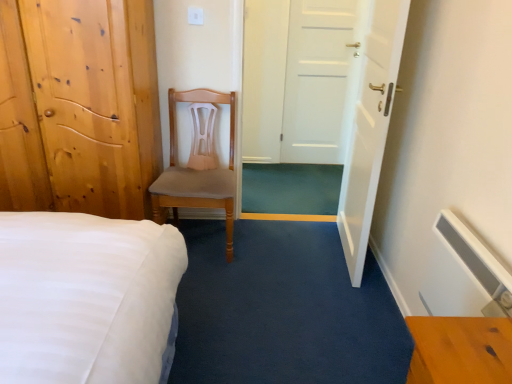
Describe the element at coordinates (316, 80) in the screenshot. The image size is (512, 384). I see `white matte door at center, which appears as the 2th door when viewed from the right` at that location.

The width and height of the screenshot is (512, 384). In order to click on white matte door at center, arranged as the 2th door when viewed from the left in this screenshot , I will do `click(316, 80)`.

The width and height of the screenshot is (512, 384). Describe the element at coordinates (198, 171) in the screenshot. I see `light brown wood chair at center` at that location.

The width and height of the screenshot is (512, 384). I want to click on white matte door at center, arranged as the 2th door when viewed from the left, so point(316,80).

Measure the distance from light brown wood chair at center to white matte door at center, arranged as the 2th door when viewed from the left.

light brown wood chair at center is 1.45 meters from white matte door at center, arranged as the 2th door when viewed from the left.

From a real-world perspective, which object stands above the other?

white matte door at center, arranged as the 2th door when viewed from the left, from a real-world perspective.

Image resolution: width=512 pixels, height=384 pixels. What are the coordinates of `door that is the 1st one when counting rightward from the light brown wood chair at center` in the screenshot? It's located at (316, 80).

Which of these two, light brown wooden door at left, which is the first door from left to right, or light brown wood chair at center, stands taller?

light brown wooden door at left, which is the first door from left to right, is taller.

Is the depth of light brown wooden door at left, which is the first door from left to right, less than that of light brown wood chair at center?

Yes, it is.

You are a GUI agent. You are given a task and a screenshot of the screen. Output one action in this format:
    pyautogui.click(x=<x>, y=<y>)
    Task: Click on the door that is the 2nd object located in front of the light brown wood chair at center
    The height and width of the screenshot is (384, 512).
    Given the screenshot: What is the action you would take?
    pyautogui.click(x=96, y=101)

Is light brown wooden door at left, the third door positioned from the right, positioned beyond the bounds of light brown wood chair at center?

Yes, light brown wooden door at left, the third door positioned from the right, is located beyond the bounds of light brown wood chair at center.

Consider the image. Considering the relative sizes of light brown wood chair at center and white glossy door at center, placed as the first door when sorted from right to left, in the image provided, is light brown wood chair at center smaller than white glossy door at center, placed as the first door when sorted from right to left,?

Incorrect, light brown wood chair at center is not smaller in size than white glossy door at center, placed as the first door when sorted from right to left.

Is light brown wood chair at center positioned with its back to white glossy door at center, placed as the first door when sorted from right to left?

No.

From the image's perspective, between light brown wood chair at center and white glossy door at center, placed as the first door when sorted from right to left, which one is located above?

white glossy door at center, placed as the first door when sorted from right to left, appears higher in the image.

Considering the positions of objects light brown wood chair at center and white glossy door at center, placed as the first door when sorted from right to left, in the image provided, who is more to the left, light brown wood chair at center or white glossy door at center, placed as the first door when sorted from right to left,?

light brown wood chair at center is more to the left.

Which door is the 2nd one when counting from the back of the light brown wooden door at left, the third door positioned from the right? Please provide its 2D coordinates.

[(316, 80)]

Is point (119, 186) less distant than point (303, 11)?

That is True.

Is light brown wooden door at left, which is the first door from left to right, at the left side of white matte door at center, arranged as the 2th door when viewed from the left?

Correct, you'll find light brown wooden door at left, which is the first door from left to right, to the left of white matte door at center, arranged as the 2th door when viewed from the left.

From a real-world perspective, relative to white matte door at center, which appears as the 2th door when viewed from the right, is white glossy door at center, placed as the first door when sorted from right to left, vertically above or below?

In terms of real-world spatial position, white glossy door at center, placed as the first door when sorted from right to left, is above white matte door at center, which appears as the 2th door when viewed from the right.

The height and width of the screenshot is (384, 512). Identify the location of door behind the white glossy door at center, placed as the first door when sorted from right to left. (316, 80).

Can you confirm if white glossy door at center, the 3th door viewed from the left, is thinner than white matte door at center, arranged as the 2th door when viewed from the left?

In fact, white glossy door at center, the 3th door viewed from the left, might be wider than white matte door at center, arranged as the 2th door when viewed from the left.

Is point (360, 39) positioned behind point (303, 21)?

No, (360, 39) is closer to viewer.

Are white glossy door at center, the 3th door viewed from the left, and light brown wood chair at center located far from each other?

No, white glossy door at center, the 3th door viewed from the left, is not far from light brown wood chair at center.

Could you measure the distance between white glossy door at center, placed as the first door when sorted from right to left, and light brown wood chair at center?

They are 33.72 inches apart.

Does point (404, 27) appear closer or farther from the camera than point (230, 129)?

Point (404, 27) appears to be closer to the viewer than point (230, 129).

From a real-world perspective, who is located higher, white glossy door at center, placed as the first door when sorted from right to left, or light brown wood chair at center?

white glossy door at center, placed as the first door when sorted from right to left, is physically above.

Is the depth of white matte door at center, arranged as the 2th door when viewed from the left, greater than that of light brown wood chair at center?

Yes, it is.

From the image's perspective, is white matte door at center, which appears as the 2th door when viewed from the right, above or below light brown wood chair at center?

white matte door at center, which appears as the 2th door when viewed from the right, is situated higher than light brown wood chair at center in the image.

Is white matte door at center, arranged as the 2th door when viewed from the left, facing away from light brown wood chair at center?

No, light brown wood chair at center is not at the back of white matte door at center, arranged as the 2th door when viewed from the left.

Does white matte door at center, which appears as the 2th door when viewed from the right, have a lesser width compared to light brown wood chair at center?

Yes, white matte door at center, which appears as the 2th door when viewed from the right, is thinner than light brown wood chair at center.

The height and width of the screenshot is (384, 512). Find the location of `chair that appears in front of the white matte door at center, which appears as the 2th door when viewed from the right`. chair that appears in front of the white matte door at center, which appears as the 2th door when viewed from the right is located at coordinates (198, 171).

Where is `chair lying behind the light brown wooden door at left, the third door positioned from the right`? chair lying behind the light brown wooden door at left, the third door positioned from the right is located at coordinates 198,171.

Looking at the image, which one is located further to light brown wood chair at center, white matte door at center, arranged as the 2th door when viewed from the left, or light brown wooden door at left, which is the first door from left to right?

Based on the image, white matte door at center, arranged as the 2th door when viewed from the left, appears to be further to light brown wood chair at center.

Estimate the real-world distances between objects in this image. Which object is closer to light brown wooden door at left, the third door positioned from the right, light brown wood chair at center or white glossy door at center, the 3th door viewed from the left?

Based on the image, light brown wood chair at center appears to be nearer to light brown wooden door at left, the third door positioned from the right.

Based on their spatial positions, is white glossy door at center, placed as the first door when sorted from right to left, or light brown wooden door at left, the third door positioned from the right, further from white matte door at center, which appears as the 2th door when viewed from the right?

The object further to white matte door at center, which appears as the 2th door when viewed from the right, is light brown wooden door at left, the third door positioned from the right.

From the image, which object appears to be nearer to light brown wood chair at center, white glossy door at center, the 3th door viewed from the left, or light brown wooden door at left, which is the first door from left to right?

light brown wooden door at left, which is the first door from left to right, lies closer to light brown wood chair at center than the other object.

Based on their spatial positions, is light brown wood chair at center or white matte door at center, arranged as the 2th door when viewed from the left, further from light brown wooden door at left, the third door positioned from the right?

white matte door at center, arranged as the 2th door when viewed from the left, lies further to light brown wooden door at left, the third door positioned from the right, than the other object.

Estimate the real-world distances between objects in this image. Which object is closer to light brown wood chair at center, white matte door at center, arranged as the 2th door when viewed from the left, or white glossy door at center, the 3th door viewed from the left?

white glossy door at center, the 3th door viewed from the left, lies closer to light brown wood chair at center than the other object.

Based on their spatial positions, is white glossy door at center, the 3th door viewed from the left, or white matte door at center, which appears as the 2th door when viewed from the right, further from light brown wooden door at left, the third door positioned from the right?

Based on the image, white matte door at center, which appears as the 2th door when viewed from the right, appears to be further to light brown wooden door at left, the third door positioned from the right.

In the scene shown: Based on their spatial positions, is light brown wooden door at left, the third door positioned from the right, or light brown wood chair at center closer to white matte door at center, arranged as the 2th door when viewed from the left?

The object closer to white matte door at center, arranged as the 2th door when viewed from the left, is light brown wood chair at center.

Where is `chair located between light brown wooden door at left, which is the first door from left to right, and white matte door at center, which appears as the 2th door when viewed from the right, in the depth direction`? This screenshot has height=384, width=512. chair located between light brown wooden door at left, which is the first door from left to right, and white matte door at center, which appears as the 2th door when viewed from the right, in the depth direction is located at coordinates (198, 171).

Find the location of `chair between light brown wooden door at left, the third door positioned from the right, and white glossy door at center, placed as the first door when sorted from right to left, from left to right`. chair between light brown wooden door at left, the third door positioned from the right, and white glossy door at center, placed as the first door when sorted from right to left, from left to right is located at coordinates (198, 171).

Where is `chair located between white glossy door at center, placed as the first door when sorted from right to left, and white matte door at center, arranged as the 2th door when viewed from the left, in the depth direction`? The image size is (512, 384). chair located between white glossy door at center, placed as the first door when sorted from right to left, and white matte door at center, arranged as the 2th door when viewed from the left, in the depth direction is located at coordinates (198, 171).

This screenshot has height=384, width=512. Find the location of `door positioned between light brown wooden door at left, the third door positioned from the right, and white matte door at center, which appears as the 2th door when viewed from the right, from near to far`. door positioned between light brown wooden door at left, the third door positioned from the right, and white matte door at center, which appears as the 2th door when viewed from the right, from near to far is located at coordinates (368, 122).